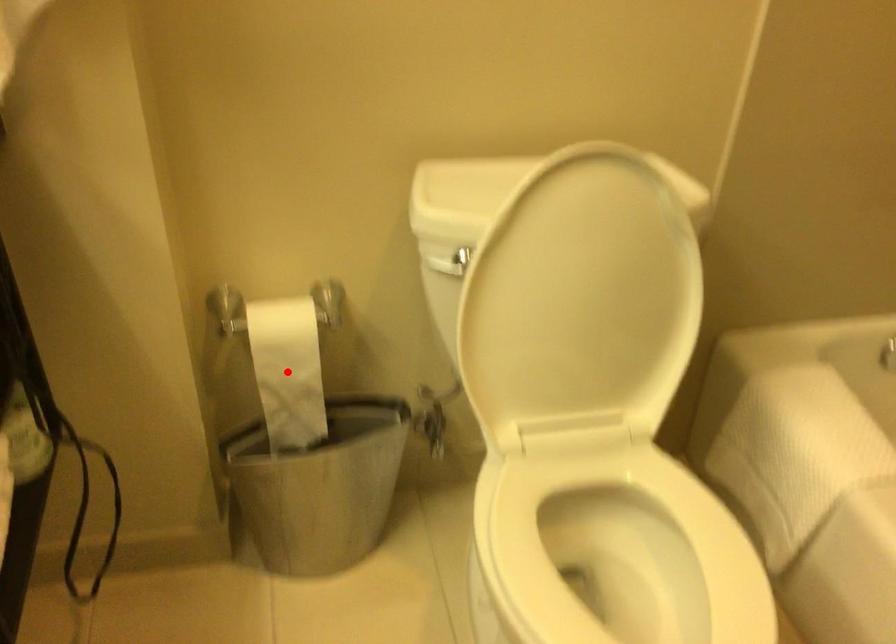
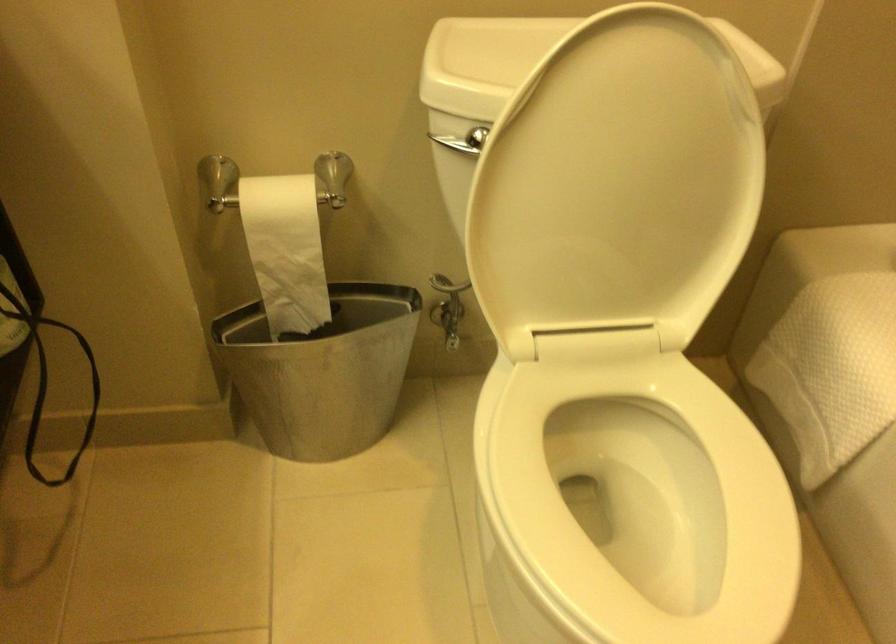
Question: I am providing you with two images of the same scene from different viewpoints. A red point is shown in image1. For the corresponding object point in image2, is it positioned nearer or farther from the camera?

Choices:
 (A) Nearer
 (B) Farther

Answer: (A)